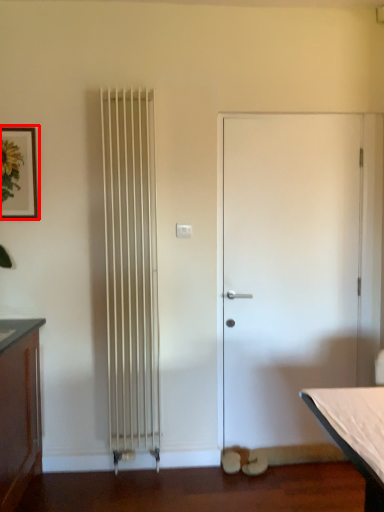
Question: Where is picture frame (annotated by the red box) located in relation to door in the image?

Choices:
 (A) left
 (B) right

Answer: (A)